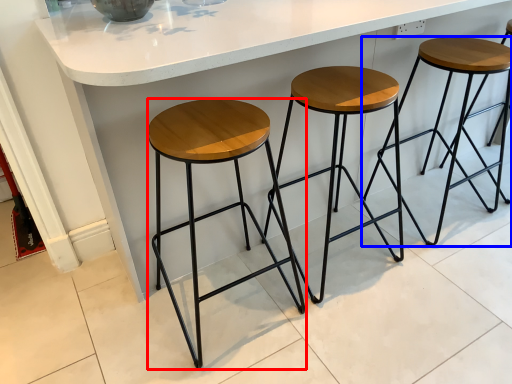
Question: Which object is closer to the camera taking this photo, stool (highlighted by a red box) or stool (highlighted by a blue box)?

Choices:
 (A) stool
 (B) stool

Answer: (A)